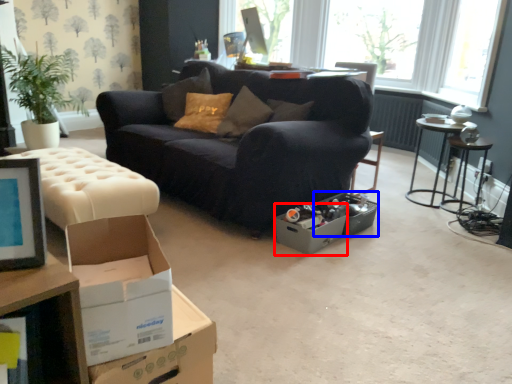
Question: Which object appears closest to the camera in this image, cardboard box (highlighted by a red box) or storage box (highlighted by a blue box)?

Choices:
 (A) cardboard box
 (B) storage box

Answer: (A)